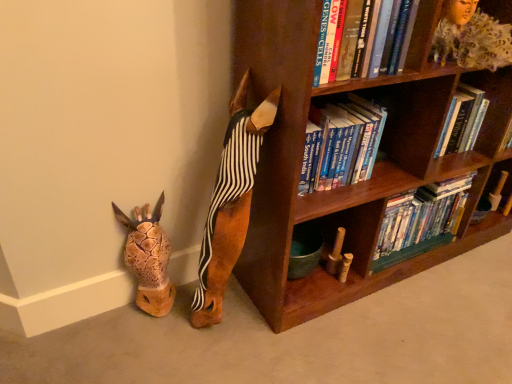
This screenshot has width=512, height=384. What are the coordinates of `free spot to the left of brown wooden dog at center, placed as the first animal when sorted from right to left` in the screenshot? It's located at (167, 318).